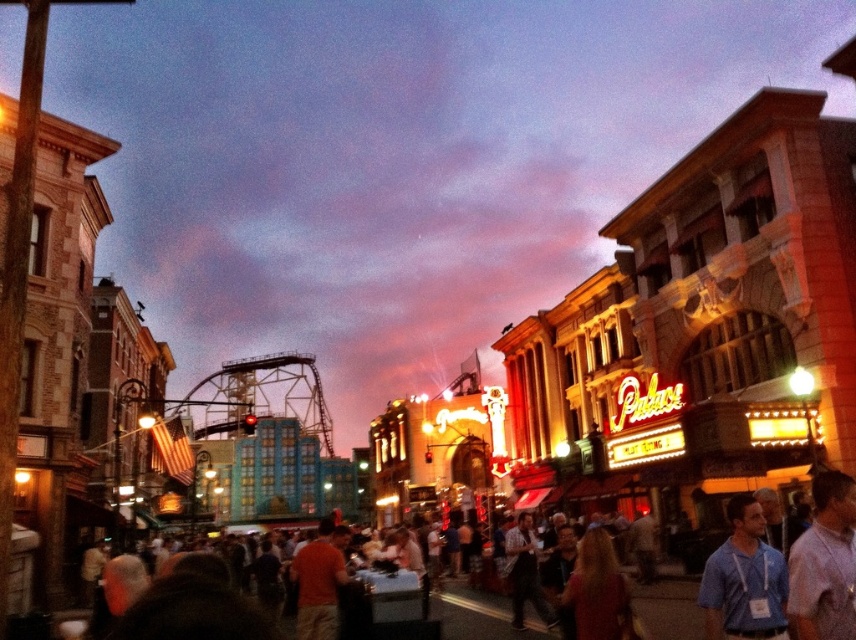
Question: Can you confirm if blue fabric shirt at center is smaller than human skin textured crowd at center?

Choices:
 (A) yes
 (B) no

Answer: (A)

Question: Which object appears closest to the camera in this image?

Choices:
 (A) human skin textured crowd at center
 (B) blue fabric shirt at center

Answer: (A)

Question: Which point is farther to the camera?

Choices:
 (A) (639, 596)
 (B) (744, 579)

Answer: (A)

Question: Is blue fabric shirt at center to the right of human skin textured crowd at center from the viewer's perspective?

Choices:
 (A) yes
 (B) no

Answer: (A)

Question: Does blue fabric shirt at center appear on the right side of human skin textured crowd at center?

Choices:
 (A) no
 (B) yes

Answer: (B)